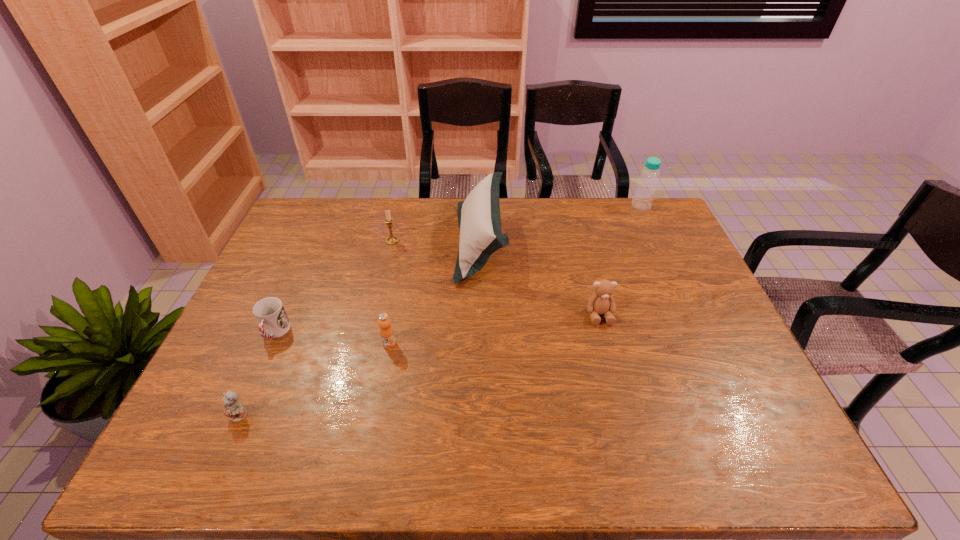
Where is `vacant area between the cushion and the bottle`? The height and width of the screenshot is (540, 960). vacant area between the cushion and the bottle is located at coordinates (561, 224).

You are a GUI agent. You are given a task and a screenshot of the screen. Output one action in this format:
    pyautogui.click(x=<x>, y=<y>)
    Task: Click on the object that can be found as the fifth closest to the cup
    
    Given the screenshot: What is the action you would take?
    pyautogui.click(x=601, y=302)

Find the location of `object that is the second nearest to the shorter teddy bear`. object that is the second nearest to the shorter teddy bear is located at coordinates 386,331.

At what (x,y) coordinates should I click in order to perform the action: click on vacant area that satisfies the following two spatial constraints: 1. on the surface of the cushion; 2. on the front-facing side of the nearest object. Please return your answer as a coordinate pair (x, y). Image resolution: width=960 pixels, height=540 pixels. Looking at the image, I should click on (481, 416).

The image size is (960, 540). What are the coordinates of `vacant space that satisfies the following two spatial constraints: 1. on the surface of the cushion; 2. on the front label of the fourth object from left to right` in the screenshot? It's located at point(481,344).